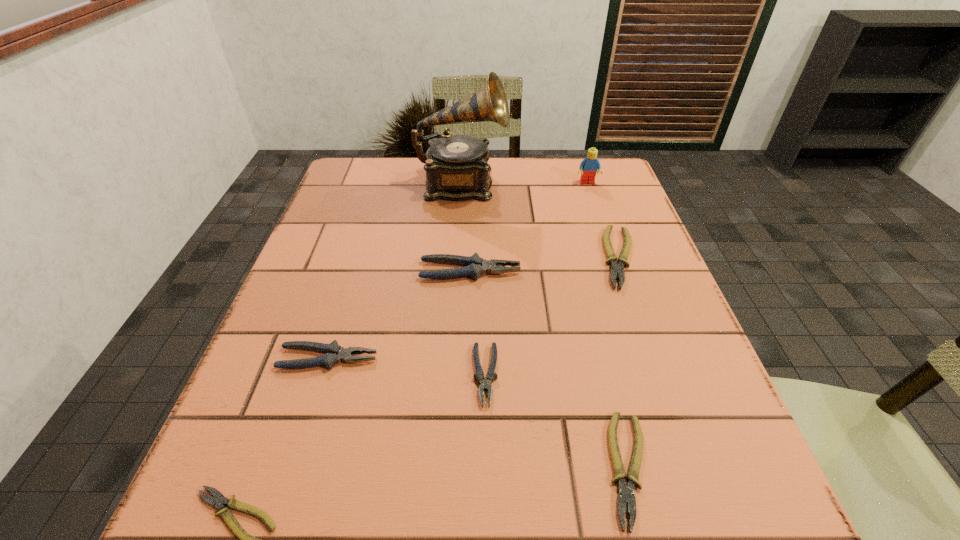
At what (x,y) coordinates should I click in order to perform the action: click on the second yellow pliers from left to right. Please return your answer as a coordinate pair (x, y). The image size is (960, 540). Looking at the image, I should click on (626, 493).

Identify the location of the second shortest object. (626, 493).

The height and width of the screenshot is (540, 960). I want to click on free region located on the horn of the tallest object, so click(x=592, y=185).

The height and width of the screenshot is (540, 960). I want to click on free space located 0.220m on the face of the Lego, so click(x=606, y=237).

Find the location of a particular element. free space located 0.100m at the gripping part of the tallest pliers is located at coordinates (567, 271).

You are a GUI agent. You are given a task and a screenshot of the screen. Output one action in this format:
    pyautogui.click(x=<x>, y=<y>)
    Task: Click on the free point located at the gripping part of the second biggest gray pliers
    This screenshot has height=540, width=960.
    Given the screenshot: What is the action you would take?
    pyautogui.click(x=469, y=359)

What are the coordinates of `vacant point located on the front of the farthest yellow pliers` in the screenshot? It's located at (639, 314).

Find the location of a particular element. Image resolution: width=960 pixels, height=540 pixels. free point located 0.330m on the back of the second pliers from right to left is located at coordinates (581, 272).

At what (x,y) coordinates should I click in order to perform the action: click on phonograph record that is positioned at the far edge. Please return your answer as a coordinate pair (x, y). Image resolution: width=960 pixels, height=540 pixels. Looking at the image, I should click on (456, 166).

Locate an element on the screen. Lego that is at the far edge is located at coordinates (588, 167).